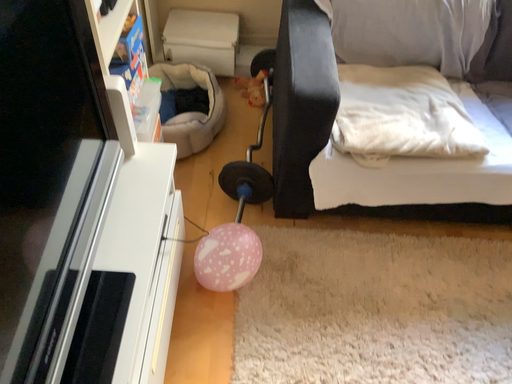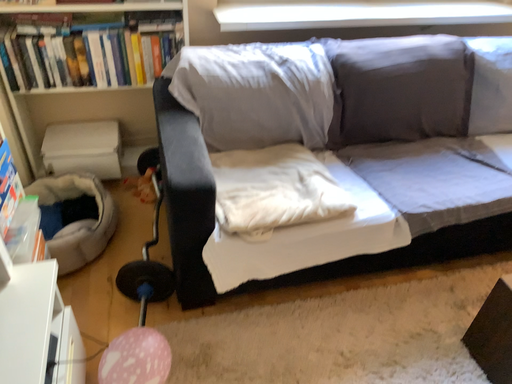
Question: How did the camera likely rotate when shooting the video?

Choices:
 (A) rotated downward
 (B) rotated upward

Answer: (B)